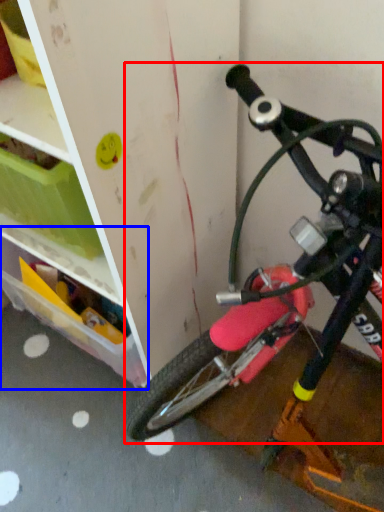
Question: Which object appears closest to the camera in this image, bicycle (highlighted by a red box) or storage box (highlighted by a blue box)?

Choices:
 (A) bicycle
 (B) storage box

Answer: (A)